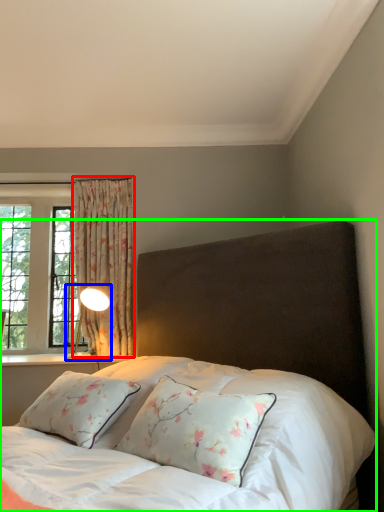
Question: Which object is the closest to the curtain (highlighted by a red box)? Choose among these: table lamp (highlighted by a blue box) or bed (highlighted by a green box).

Choices:
 (A) table lamp
 (B) bed

Answer: (A)